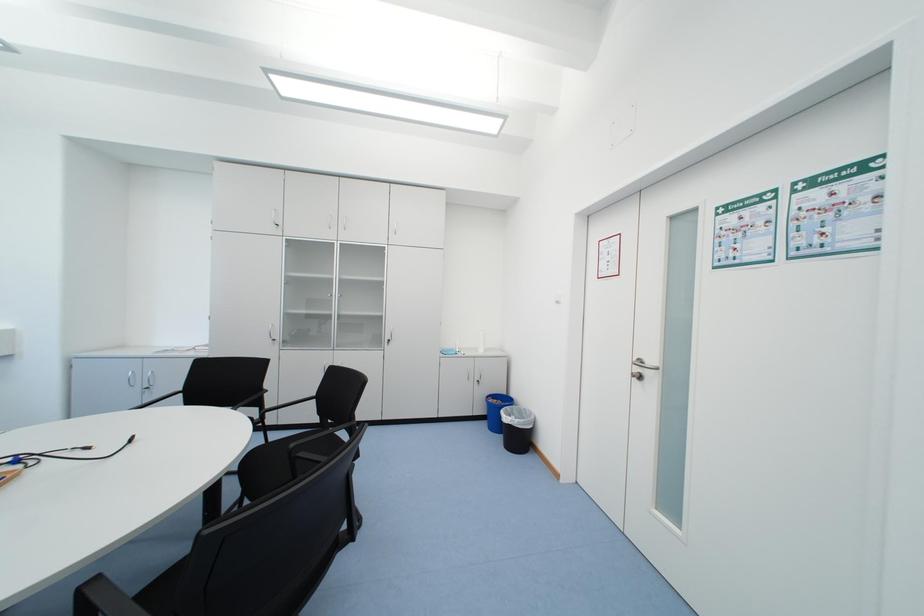
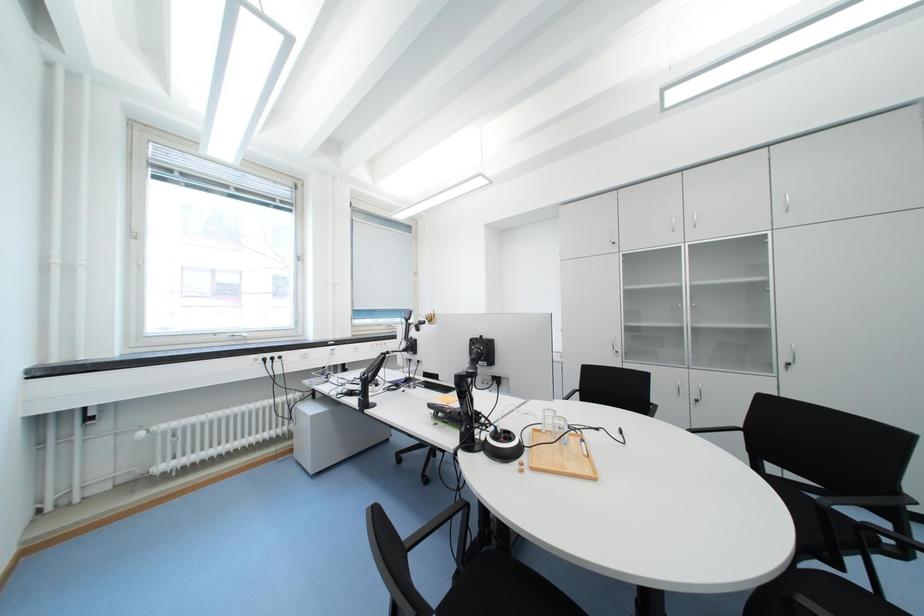
Question: The images are taken continuously from a first-person perspective. In which direction is your viewpoint rotating?

Choices:
 (A) Left
 (B) Right
 (C) Up
 (D) Down

Answer: (A)